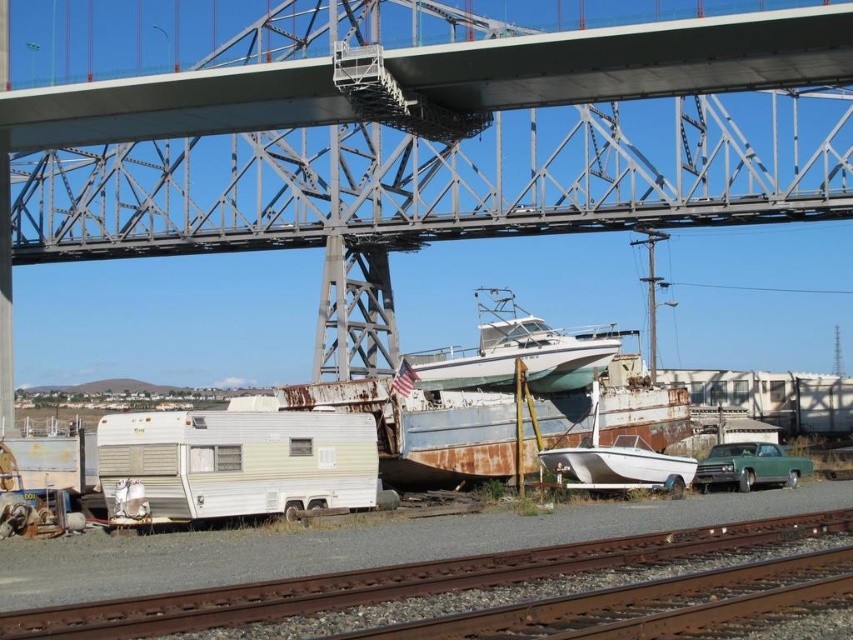
Question: Does metallic gray bridge at upper center appear over white glossy boat at center?

Choices:
 (A) yes
 (B) no

Answer: (A)

Question: Which of the following is the closest to the observer?

Choices:
 (A) (495, 301)
 (B) (608, 138)
 (C) (463, 588)

Answer: (C)

Question: Can you confirm if metallic gray bridge at upper center is wider than white glossy boat at center?

Choices:
 (A) yes
 (B) no

Answer: (A)

Question: Which of the following is the farthest from the observer?

Choices:
 (A) (166, 186)
 (B) (677, 476)
 (C) (737, 474)
 (D) (131, 634)

Answer: (A)

Question: Among these points, which one is nearest to the camera?

Choices:
 (A) [x=677, y=493]
 (B) [x=248, y=609]

Answer: (B)

Question: Is metallic gray bridge at upper center below green matte car at lower right?

Choices:
 (A) yes
 (B) no

Answer: (B)